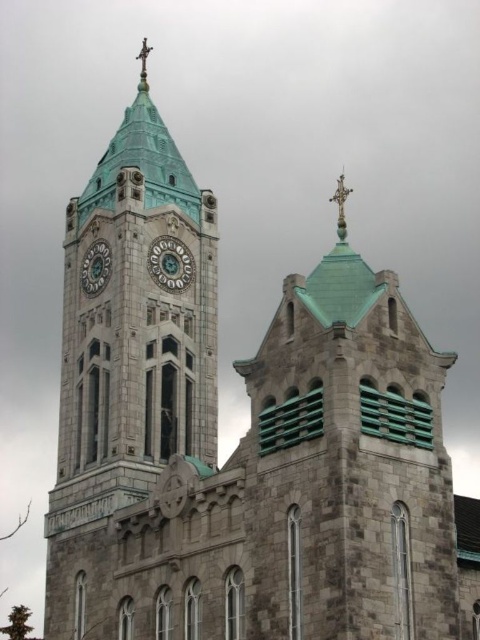
You are an architect reviewing the church design. You notice two crosses on the clock tower. The silver metallic cross at upper center and the metallic cross at top. Which cross is smaller in size?

The silver metallic cross at upper center is smaller in size than the metallic cross at top because it occupies less space.